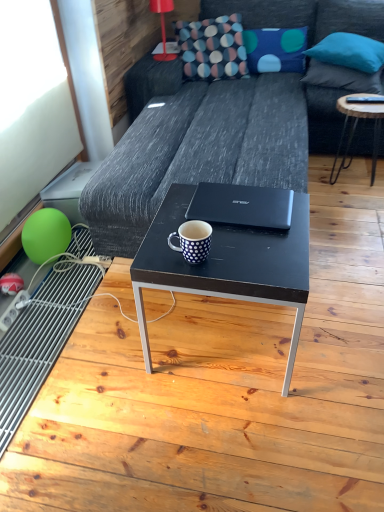
Question: Does wooden round table at right touch textured multicolored pillow at upper center?

Choices:
 (A) no
 (B) yes

Answer: (A)

Question: Considering the relative positions of wooden round table at right and textured multicolored pillow at upper center in the image provided, is wooden round table at right to the right of textured multicolored pillow at upper center from the viewer's perspective?

Choices:
 (A) yes
 (B) no

Answer: (A)

Question: From the image's perspective, does wooden round table at right appear higher than textured multicolored pillow at upper center?

Choices:
 (A) yes
 (B) no

Answer: (B)

Question: From a real-world perspective, is wooden round table at right on top of textured multicolored pillow at upper center?

Choices:
 (A) no
 (B) yes

Answer: (A)

Question: Is wooden round table at right looking in the opposite direction of textured multicolored pillow at upper center?

Choices:
 (A) yes
 (B) no

Answer: (B)

Question: Is wooden round table at right outside of textured multicolored pillow at upper center?

Choices:
 (A) yes
 (B) no

Answer: (A)

Question: Is green rubber balloon at lower left completely or partially outside of teal fabric pillow at upper right, the second pillow in the left-to-right sequence?

Choices:
 (A) yes
 (B) no

Answer: (A)

Question: Is green rubber balloon at lower left looking in the opposite direction of teal fabric pillow at upper right, the second pillow in the left-to-right sequence?

Choices:
 (A) yes
 (B) no

Answer: (B)

Question: Is green rubber balloon at lower left at the left side of teal fabric pillow at upper right, the second pillow in the left-to-right sequence?

Choices:
 (A) yes
 (B) no

Answer: (A)

Question: Is green rubber balloon at lower left aimed at teal fabric pillow at upper right, the second pillow in the left-to-right sequence?

Choices:
 (A) yes
 (B) no

Answer: (B)

Question: Is teal fabric pillow at upper right, the second pillow in the left-to-right sequence, inside green rubber balloon at lower left?

Choices:
 (A) no
 (B) yes

Answer: (A)

Question: Considering the relative sizes of green rubber balloon at lower left and teal fabric pillow at upper right, the 2th pillow in the right-to-left sequence, in the image provided, is green rubber balloon at lower left taller than teal fabric pillow at upper right, the 2th pillow in the right-to-left sequence,?

Choices:
 (A) yes
 (B) no

Answer: (A)

Question: Is white dotted mug at center smaller than red plastic lamp at upper center?

Choices:
 (A) no
 (B) yes

Answer: (B)